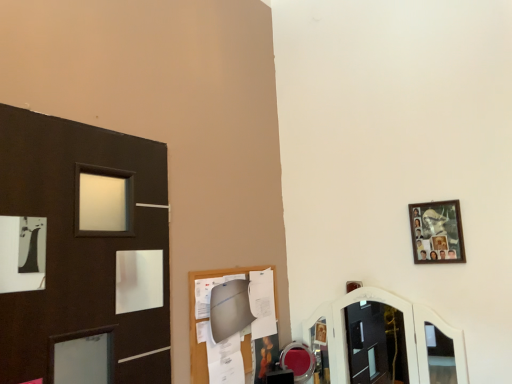
What do you see at coordinates (298, 361) in the screenshot?
I see `shiny red mirror at center` at bounding box center [298, 361].

Find the location of `shiny red mirror at center`. shiny red mirror at center is located at coordinates (298, 361).

Describe the element at coordinates (437, 232) in the screenshot. I see `wooden photo frame at upper right` at that location.

This screenshot has width=512, height=384. I want to click on wooden photo frame at upper right, so click(x=437, y=232).

You are a GUI agent. You are given a task and a screenshot of the screen. Output one action in this format:
    pyautogui.click(x=<x>, y=<y>)
    Task: Click on the shiny red mirror at center
    The image size is (512, 384).
    Given the screenshot: What is the action you would take?
    298,361

Considering the relative positions of shiny red mirror at center and wooden photo frame at upper right in the image provided, is shiny red mirror at center to the left or to the right of wooden photo frame at upper right?

From the image, it's evident that shiny red mirror at center is to the left of wooden photo frame at upper right.

Considering the relative positions of shiny red mirror at center and wooden photo frame at upper right in the image provided, is shiny red mirror at center behind wooden photo frame at upper right?

Yes, shiny red mirror at center is further from the camera.

Considering the points (301, 352) and (442, 222), which point is in front, point (301, 352) or point (442, 222)?

The point (442, 222) is in front.

From the image's perspective, is shiny red mirror at center under wooden photo frame at upper right?

Yes, from the image's perspective, shiny red mirror at center is beneath wooden photo frame at upper right.

From a real-world perspective, relative to wooden photo frame at upper right, is shiny red mirror at center vertically above or below?

shiny red mirror at center is situated lower than wooden photo frame at upper right in the real world.

Considering the sizes of shiny red mirror at center and wooden photo frame at upper right in the image, is shiny red mirror at center wider or thinner than wooden photo frame at upper right?

In the image, shiny red mirror at center appears to be wider than wooden photo frame at upper right.

Is shiny red mirror at center taller than wooden photo frame at upper right?

In fact, shiny red mirror at center may be shorter than wooden photo frame at upper right.

Is shiny red mirror at center smaller than wooden photo frame at upper right?

Actually, shiny red mirror at center might be larger than wooden photo frame at upper right.

Is shiny red mirror at center surrounding wooden photo frame at upper right?

No, wooden photo frame at upper right is not inside shiny red mirror at center.

In the scene shown: Is shiny red mirror at center touching wooden photo frame at upper right?

No, shiny red mirror at center is not touching wooden photo frame at upper right.

Is shiny red mirror at center facing away from wooden photo frame at upper right?

No, shiny red mirror at center's orientation is not away from wooden photo frame at upper right.

Can you tell me how much shiny red mirror at center and wooden photo frame at upper right differ in facing direction?

The angle between the facing direction of shiny red mirror at center and the facing direction of wooden photo frame at upper right is 1.79 degrees.

Locate an element on the screen. The image size is (512, 384). mirror below the wooden photo frame at upper right (from the image's perspective) is located at coordinates (298, 361).

Considering the relative positions of wooden photo frame at upper right and shiny red mirror at center in the image provided, is wooden photo frame at upper right to the left of shiny red mirror at center from the viewer's perspective?

No.

Which object is more forward, wooden photo frame at upper right or shiny red mirror at center?

wooden photo frame at upper right.

Which is in front, point (455, 200) or point (294, 361)?

Point (455, 200)

From the image's perspective, which object appears higher, wooden photo frame at upper right or shiny red mirror at center?

wooden photo frame at upper right is shown above in the image.

From a real-world perspective, is wooden photo frame at upper right located beneath shiny red mirror at center?

Actually, wooden photo frame at upper right is physically above shiny red mirror at center in the real world.

Considering the sizes of wooden photo frame at upper right and shiny red mirror at center in the image, is wooden photo frame at upper right wider or thinner than shiny red mirror at center?

Clearly, wooden photo frame at upper right has less width compared to shiny red mirror at center.

Who is shorter, wooden photo frame at upper right or shiny red mirror at center?

With less height is shiny red mirror at center.

Is wooden photo frame at upper right smaller than shiny red mirror at center?

Yes, wooden photo frame at upper right is smaller than shiny red mirror at center.

Looking at this image, is wooden photo frame at upper right located outside shiny red mirror at center?

Yes, wooden photo frame at upper right is located beyond the bounds of shiny red mirror at center.

Is wooden photo frame at upper right in contact with shiny red mirror at center?

No, wooden photo frame at upper right is not in contact with shiny red mirror at center.

Could you tell me if wooden photo frame at upper right is turned towards shiny red mirror at center?

No, wooden photo frame at upper right is not facing towards shiny red mirror at center.

Identify the location of mirror below the wooden photo frame at upper right (from a real-world perspective). This screenshot has width=512, height=384. (298, 361).

At what (x,y) coordinates should I click in order to perform the action: click on mirror below the wooden photo frame at upper right (from a real-world perspective). Please return your answer as a coordinate pair (x, y). The height and width of the screenshot is (384, 512). Looking at the image, I should click on (298, 361).

The height and width of the screenshot is (384, 512). Identify the location of mirror behind the wooden photo frame at upper right. (298, 361).